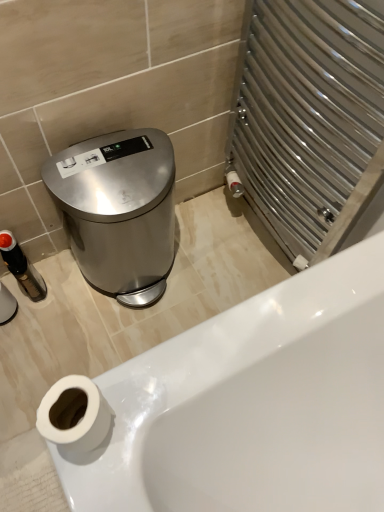
The image size is (384, 512). What are the coordinates of `vacant space situated on the left part of polished stainless steel trash can at left` in the screenshot? It's located at (50, 296).